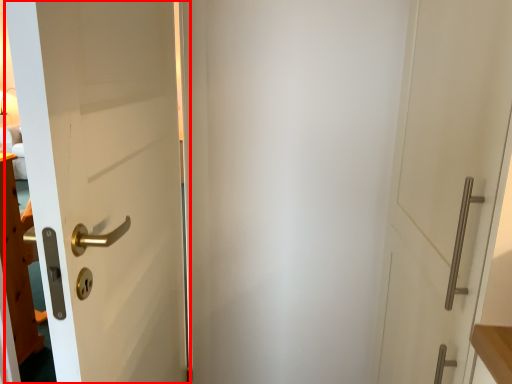
Question: From the image's perspective, where is door (annotated by the red box) located in relation to door in the image?

Choices:
 (A) below
 (B) above

Answer: (A)